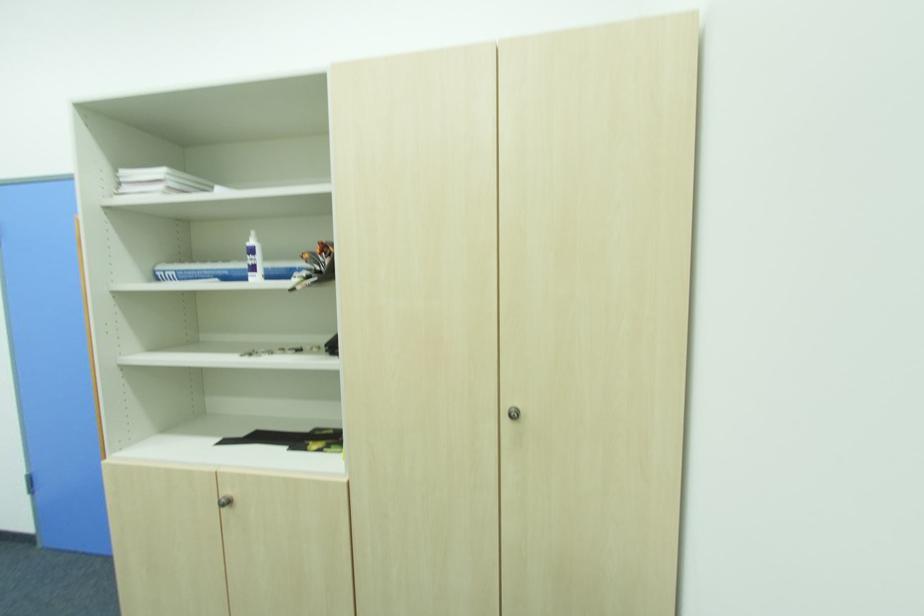
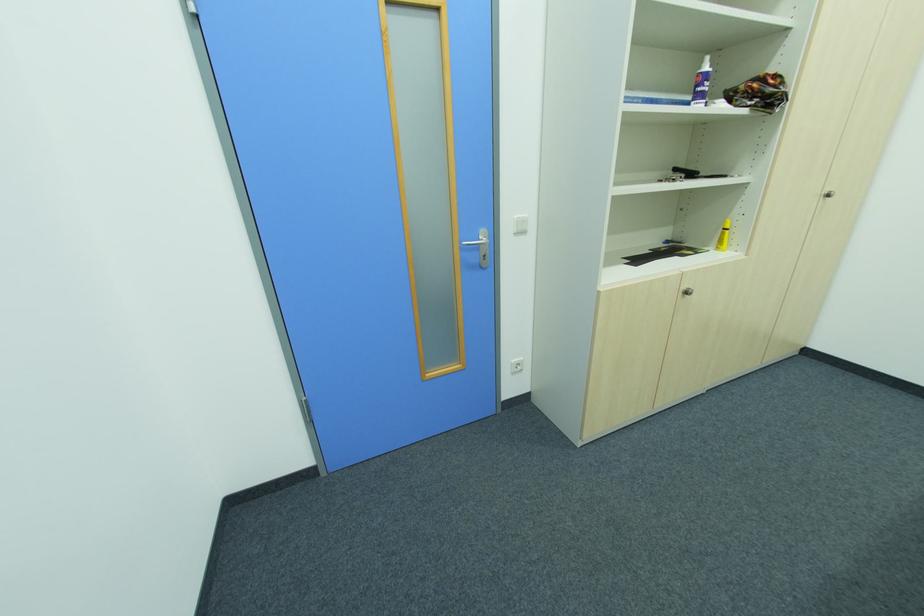
The point at (254, 252) is marked in the first image. Where is the corresponding point in the second image?

(708, 78)